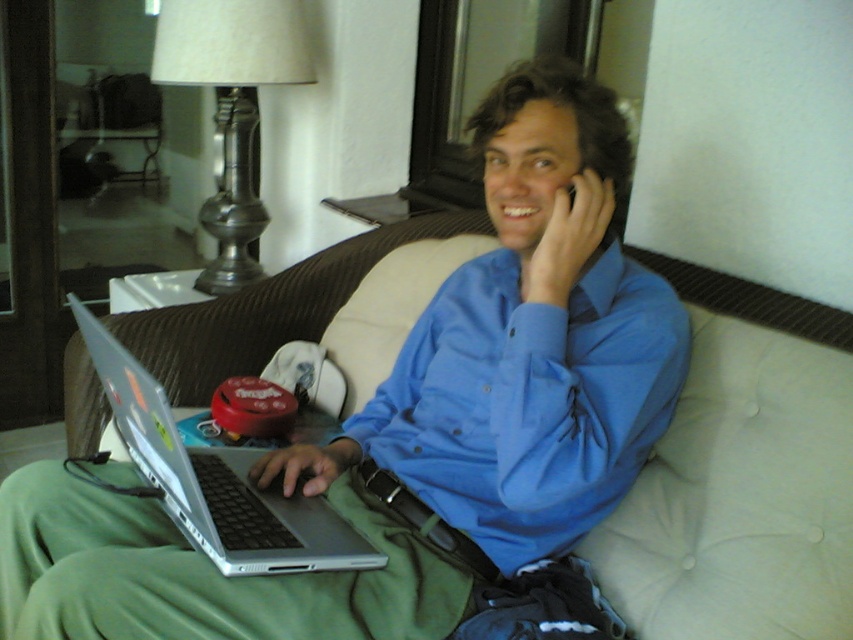
You are a delivery robot that needs to place a package on the couch between the blue smooth shirt at center and the silver metallic laptop at center. The package is 12 inches long. Can you fit it there?

The blue smooth shirt at center is 12.12 inches away from the silver metallic laptop at center. Since the package is 12 inches long, it can fit in the space between them as the distance is slightly larger than the package length.

You are a photographer trying to capture a candid shot of the person in the living room. You need to position your camera so that both the blue smooth shirt at center and the silver metallic laptop at center are visible. Based on their positions, which object should you ensure is closer to the left side of the frame to include both in the shot?

The blue smooth shirt at center is to the right of the silver metallic laptop at center, so to include both in the shot, ensure the silver metallic laptop at center is positioned closer to the left side of the frame.

Consider the image. You are a person sitting on the couch and want to place your matte silver laptop at center on the coffee table in front of you. However, you need to ensure that the laptop doesn not block your view of the blue smooth shirt at center. Based on their positions, can you move the laptop without moving the shirt?

The matte silver laptop at center is located below the blue smooth shirt at center, so moving the laptop away from its current position below the shirt would allow you to place it on the coffee table without blocking your view of the blue smooth shirt at center.